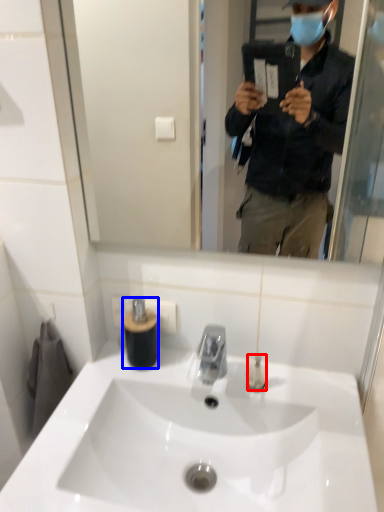
Question: Which of the following is the closest to the observer, toiletry (highlighted by a red box) or toiletry (highlighted by a blue box)?

Choices:
 (A) toiletry
 (B) toiletry

Answer: (A)